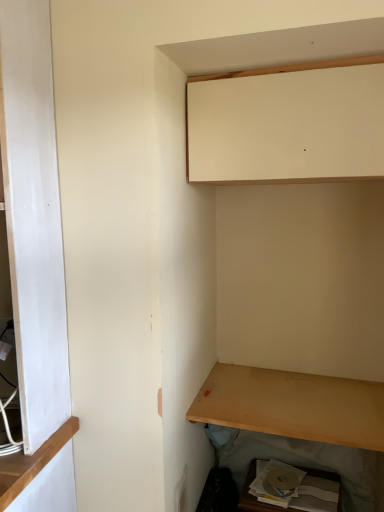
Question: Is light brown wood shelf at lower right wider or thinner than matte white cabinet at upper center, the 1th cabinetry viewed from the top?

Choices:
 (A) thin
 (B) wide

Answer: (B)

Question: Is light brown wood shelf at lower right taller or shorter than matte white cabinet at upper center, which is the second cabinetry in bottom-to-top order?

Choices:
 (A) tall
 (B) short

Answer: (B)

Question: Considering the real-world distances, which object is farthest from the light brown wood shelf at lower right?

Choices:
 (A) matte white cabinet at upper center, which is the second cabinetry in bottom-to-top order
 (B) matte cardboard box at lower right, acting as the 2th cabinetry starting from the top

Answer: (A)

Question: Which object is positioned closest to the light brown wood shelf at lower right?

Choices:
 (A) matte white cabinet at upper center, which is the second cabinetry in bottom-to-top order
 (B) matte cardboard box at lower right, placed as the 1th cabinetry when sorted from bottom to top

Answer: (B)